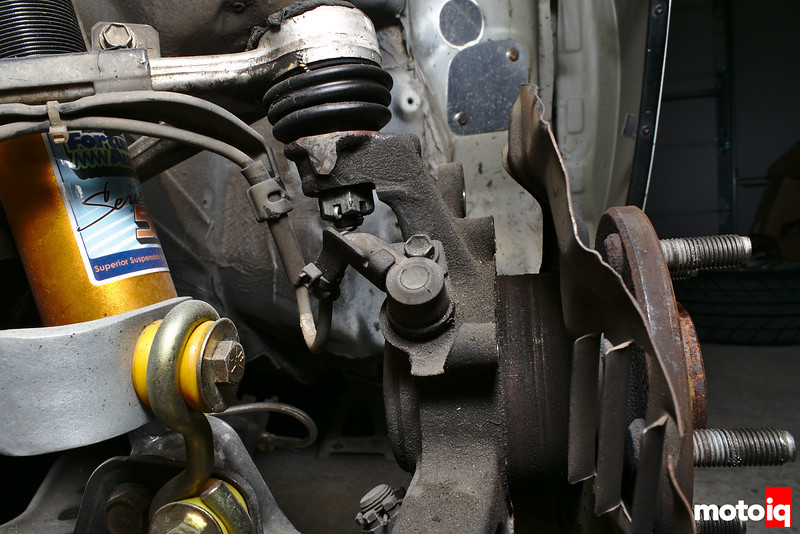
The image size is (800, 534). Identify the location of screws. (742, 436), (708, 258).